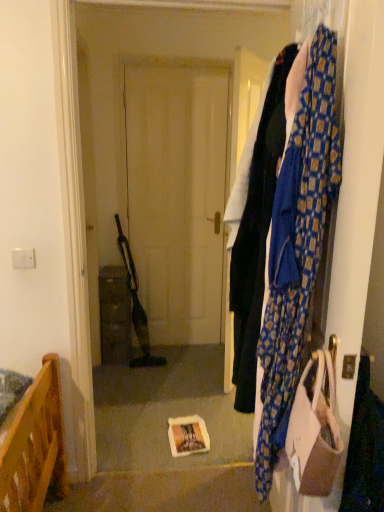
Question: From the image's perspective, is blue patterned fabric at right on top of yellow paper book at center?

Choices:
 (A) no
 (B) yes

Answer: (B)

Question: Is blue patterned fabric at right to the left of yellow paper book at center from the viewer's perspective?

Choices:
 (A) no
 (B) yes

Answer: (A)

Question: Considering the relative positions of blue patterned fabric at right and yellow paper book at center in the image provided, is blue patterned fabric at right in front of yellow paper book at center?

Choices:
 (A) no
 (B) yes

Answer: (B)

Question: Considering the relative sizes of blue patterned fabric at right and yellow paper book at center in the image provided, is blue patterned fabric at right smaller than yellow paper book at center?

Choices:
 (A) no
 (B) yes

Answer: (A)

Question: Is blue patterned fabric at right facing towards yellow paper book at center?

Choices:
 (A) yes
 (B) no

Answer: (B)

Question: From a real-world perspective, is blue patterned fabric at right on yellow paper book at center?

Choices:
 (A) no
 (B) yes

Answer: (B)

Question: From the image's perspective, is yellow paper book at center over beige fabric handbag at right?

Choices:
 (A) yes
 (B) no

Answer: (B)

Question: Can you confirm if yellow paper book at center is taller than beige fabric handbag at right?

Choices:
 (A) yes
 (B) no

Answer: (B)

Question: Is beige fabric handbag at right inside yellow paper book at center?

Choices:
 (A) yes
 (B) no

Answer: (B)

Question: Is yellow paper book at center thinner than beige fabric handbag at right?

Choices:
 (A) yes
 (B) no

Answer: (B)

Question: From the image's perspective, would you say yellow paper book at center is shown under beige fabric handbag at right?

Choices:
 (A) no
 (B) yes

Answer: (B)

Question: Is yellow paper book at center positioned behind beige fabric handbag at right?

Choices:
 (A) no
 (B) yes

Answer: (B)

Question: Is blue patterned scarf at right smaller than brown matte cabinet at center?

Choices:
 (A) yes
 (B) no

Answer: (A)